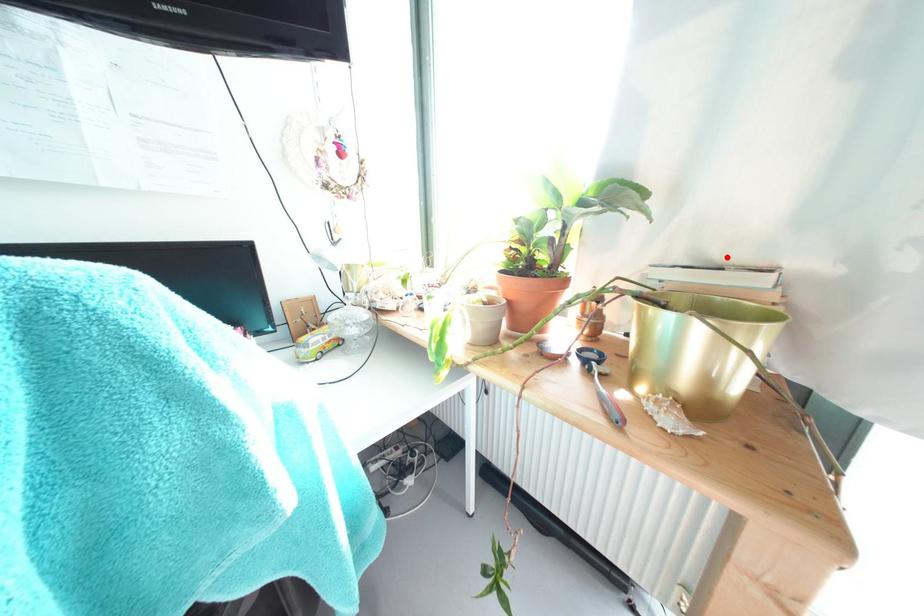
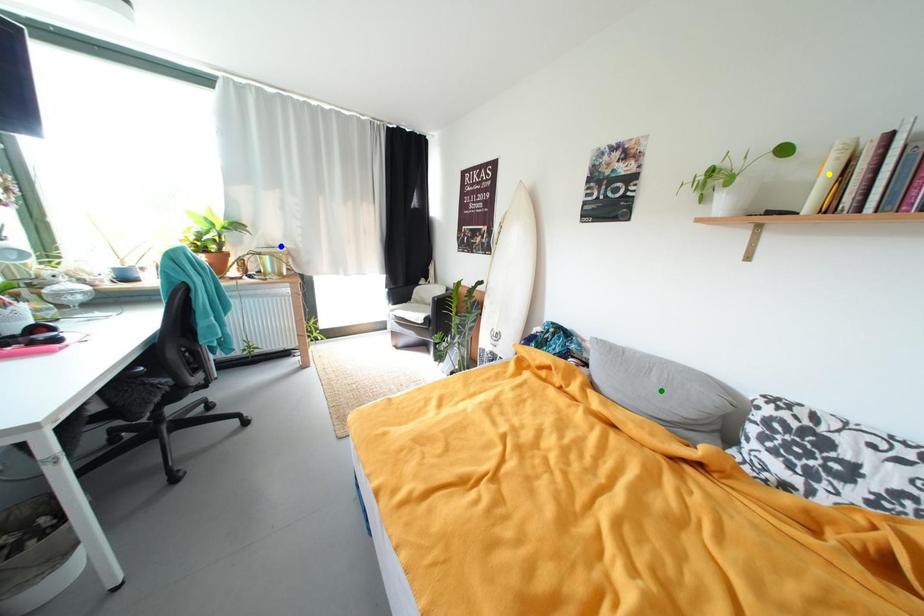
Question: I am providing you with two images of the same scene from different viewpoints. A red point is marked on the first image. You are given multiple points on the second image. Which spot in image 2 lines up with the point in image 1?

Choices:
 (A) green point
 (B) blue point
 (C) yellow point

Answer: (B)